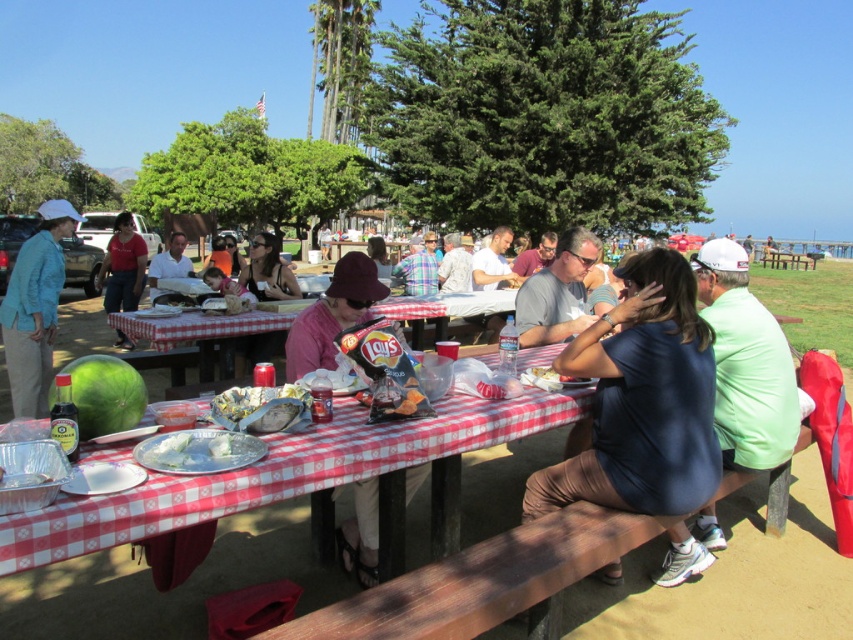
Describe the element at coordinates (33, 308) in the screenshot. Image resolution: width=853 pixels, height=640 pixels. I see `matte blue jacket at left` at that location.

This screenshot has height=640, width=853. I want to click on matte blue jacket at left, so click(33, 308).

Does blue fabric shirt at center have a lesser height compared to matte black shirt at center?

No, blue fabric shirt at center is not shorter than matte black shirt at center.

The height and width of the screenshot is (640, 853). What do you see at coordinates (640, 401) in the screenshot?
I see `blue fabric shirt at center` at bounding box center [640, 401].

Is point (596, 401) more distant than point (254, 262)?

No, it is in front of (254, 262).

The height and width of the screenshot is (640, 853). In order to click on blue fabric shirt at center in this screenshot , I will do `click(640, 401)`.

Is red checkered tablecloth at center taller than matte red shirt at center?

No.

Does point (321, 486) come closer to viewer compared to point (132, 300)?

Yes.

Identify the location of red checkered tablecloth at center. (292, 477).